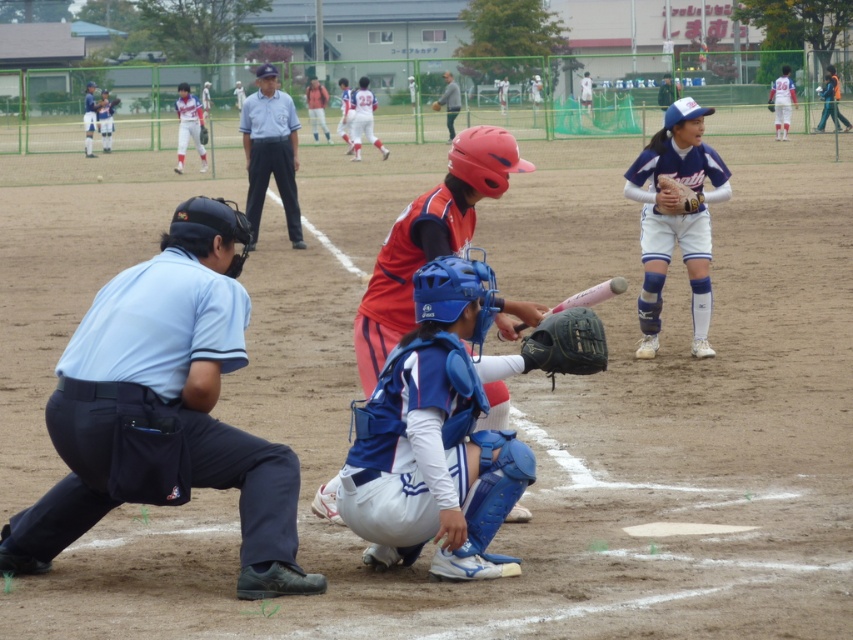
Is blue uniform at center below light blue uniform at center?

Indeed, blue uniform at center is positioned under light blue uniform at center.

Is blue uniform at center positioned behind light blue uniform at center?

No, it is in front of light blue uniform at center.

Where is `blue uniform at center`? The width and height of the screenshot is (853, 640). blue uniform at center is located at coordinates (164, 408).

How distant is blue uniform at center from white uniform at upper center?

27.50 meters

Can you confirm if blue uniform at center is thinner than white uniform at upper center?

Incorrect, blue uniform at center's width is not less than white uniform at upper center's.

Is point (189, 344) less distant than point (178, 161)?

Yes, it is.

Locate an element on the screen. Image resolution: width=853 pixels, height=640 pixels. blue uniform at center is located at coordinates (164, 408).

In the scene shown: Who is taller, gray fabric jacket at center or dark blue leather glove at center?

Standing taller between the two is gray fabric jacket at center.

From the picture: Does gray fabric jacket at center appear under dark blue leather glove at center?

Incorrect, gray fabric jacket at center is not positioned below dark blue leather glove at center.

Image resolution: width=853 pixels, height=640 pixels. What do you see at coordinates (450, 102) in the screenshot?
I see `gray fabric jacket at center` at bounding box center [450, 102].

I want to click on gray fabric jacket at center, so tap(450, 102).